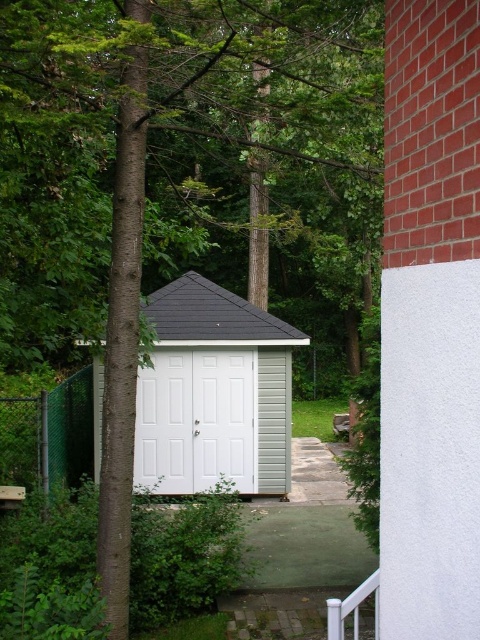
Question: Does white siding shed at center appear under white plastic rail at lower right?

Choices:
 (A) no
 (B) yes

Answer: (A)

Question: In this image, where is white siding shed at center located relative to white plastic rail at lower right?

Choices:
 (A) below
 (B) above

Answer: (B)

Question: Is white siding shed at center to the right of white plastic rail at lower right from the viewer's perspective?

Choices:
 (A) yes
 (B) no

Answer: (B)

Question: Which point is closer to the camera?

Choices:
 (A) white plastic rail at lower right
 (B) white siding shed at center

Answer: (A)